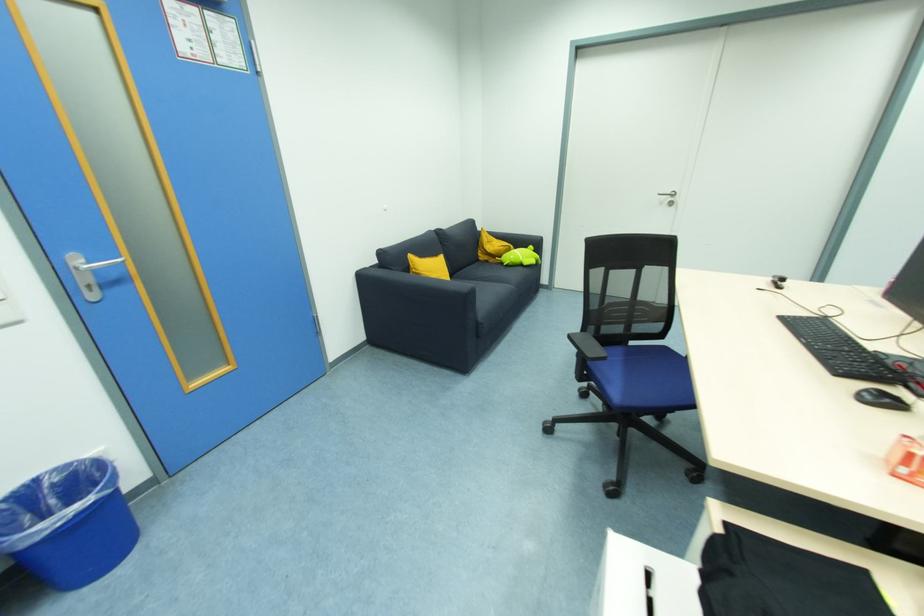
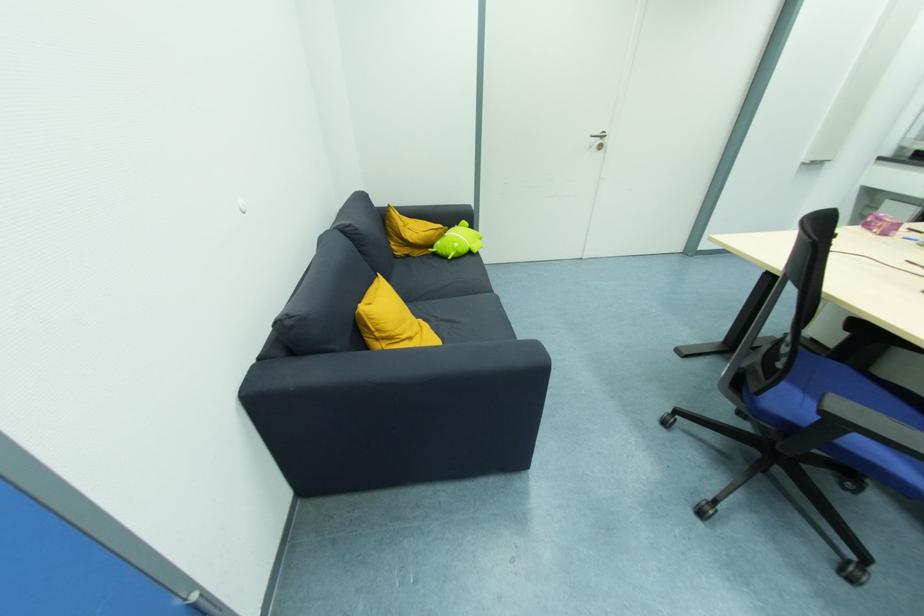
Where in the second image is the point corresponding to point 484,259 from the first image?

(403, 253)